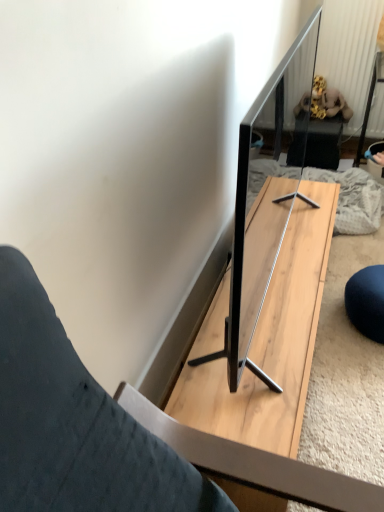
Where is `vacant area on top of light wood table at center (from a real-world perspective)`? Image resolution: width=384 pixels, height=512 pixels. vacant area on top of light wood table at center (from a real-world perspective) is located at coordinates (276, 268).